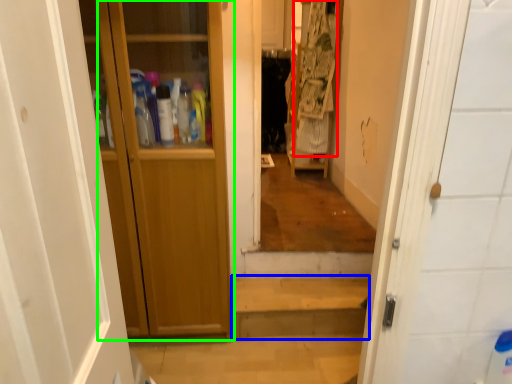
Question: Which is nearer to the laundry (highlighted by a red box)? stairwell (highlighted by a blue box) or door (highlighted by a green box).

Choices:
 (A) stairwell
 (B) door

Answer: (A)